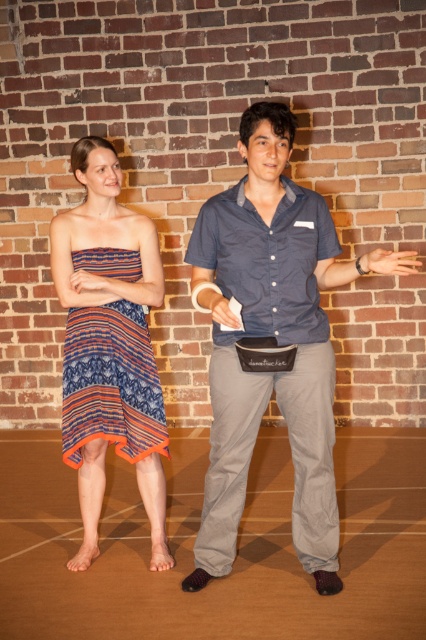
You are a photographer setting up for a photoshoot. You need to ensure that the matte blue shirt at center and the striped fabric dress at center are visible in the frame. Based on their positions, which clothing item is covering part of the other?

The matte blue shirt at center is positioned over striped fabric dress at center, so it is covering part of the striped fabric dress at center.

You are organizing a clothing donation drive and need to determine which dress takes up more space in the donation box. Based on the image, which dress between the striped fabric dress at center and the textured cotton dress at center requires more space?

The striped fabric dress at center requires more space because it is bigger than the textured cotton dress at center.